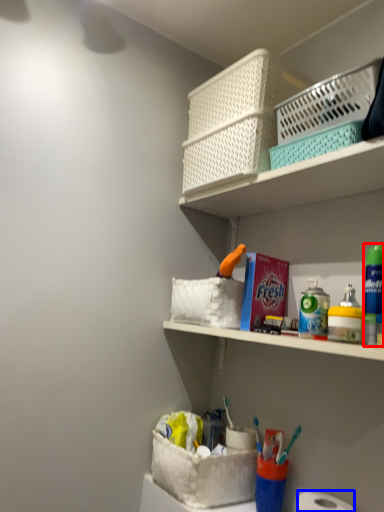
Question: Which object appears closest to the camera in this image, mouthwash (highlighted by a red box) or toilet paper (highlighted by a blue box)?

Choices:
 (A) mouthwash
 (B) toilet paper

Answer: (B)